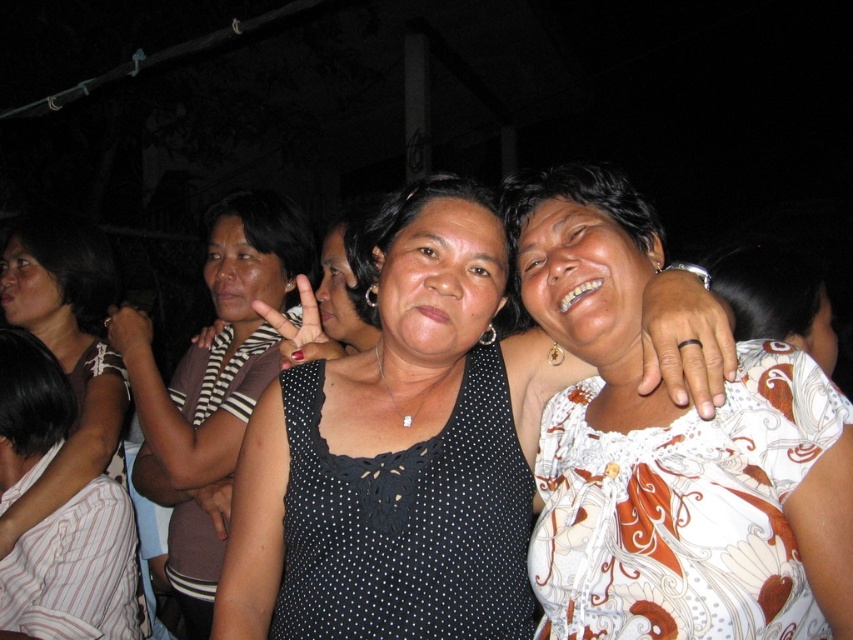
Question: Can you confirm if white printed fabric dress at center is positioned to the right of striped fabric dress at center?

Choices:
 (A) yes
 (B) no

Answer: (A)

Question: Which object appears farthest from the camera in this image?

Choices:
 (A) striped fabric dress at center
 (B) white printed fabric dress at center
 (C) black dotted fabric dress at center
 (D) matte black dress at center

Answer: (A)

Question: Is the position of white printed fabric dress at center more distant than that of matte black dress at center?

Choices:
 (A) no
 (B) yes

Answer: (A)

Question: Among these objects, which one is nearest to the camera?

Choices:
 (A) striped fabric dress at center
 (B) black dotted fabric dress at center
 (C) matte black dress at center

Answer: (B)

Question: Is white printed fabric dress at center wider than matte black dress at center?

Choices:
 (A) no
 (B) yes

Answer: (A)

Question: Which point is farther to the camera?

Choices:
 (A) striped fabric dress at center
 (B) white printed fabric dress at center
 (C) black dotted fabric dress at center

Answer: (A)